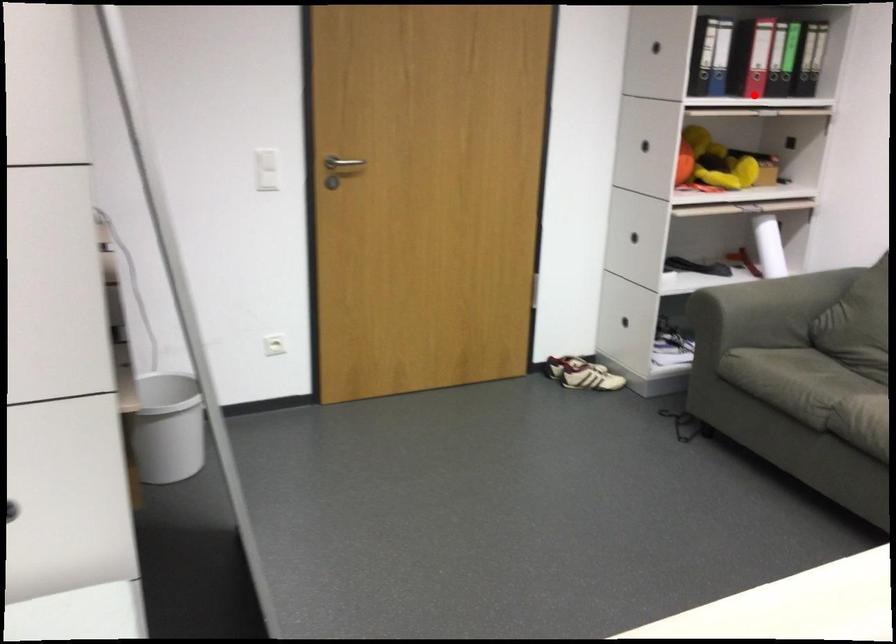
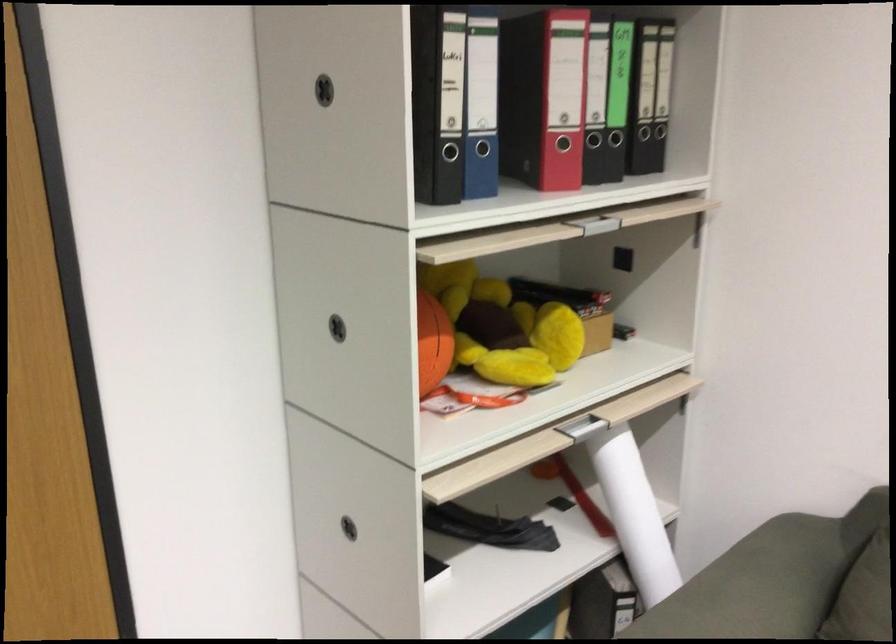
Question: I am providing you with two images of the same scene from different viewpoints. A red point is shown in image1. For the corresponding object point in image2, is it positioned nearer or farther from the camera?

Choices:
 (A) Nearer
 (B) Farther

Answer: (A)